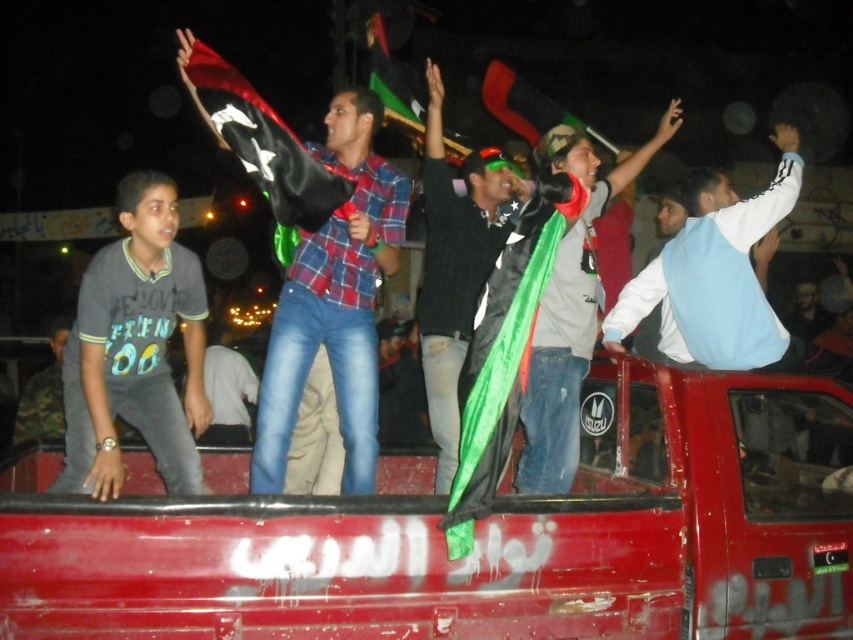
Question: Is gray cotton shirt at left closer to the viewer compared to plaid shirt at center?

Choices:
 (A) yes
 (B) no

Answer: (A)

Question: Can you confirm if gray cotton shirt at left is smaller than green fabric flag at center?

Choices:
 (A) yes
 (B) no

Answer: (B)

Question: Is plaid shirt at center bigger than green fabric flag at center?

Choices:
 (A) no
 (B) yes

Answer: (B)

Question: Which object appears closest to the camera in this image?

Choices:
 (A) green fabric flag at center
 (B) plaid shirt at center
 (C) gray cotton shirt at left

Answer: (C)

Question: Which of these objects is positioned closest to the gray cotton shirt at left?

Choices:
 (A) plaid shirt at center
 (B) green fabric flag at center

Answer: (A)

Question: Which point is farther from the camera taking this photo?

Choices:
 (A) (167, 209)
 (B) (450, 225)
 (C) (300, 259)

Answer: (B)